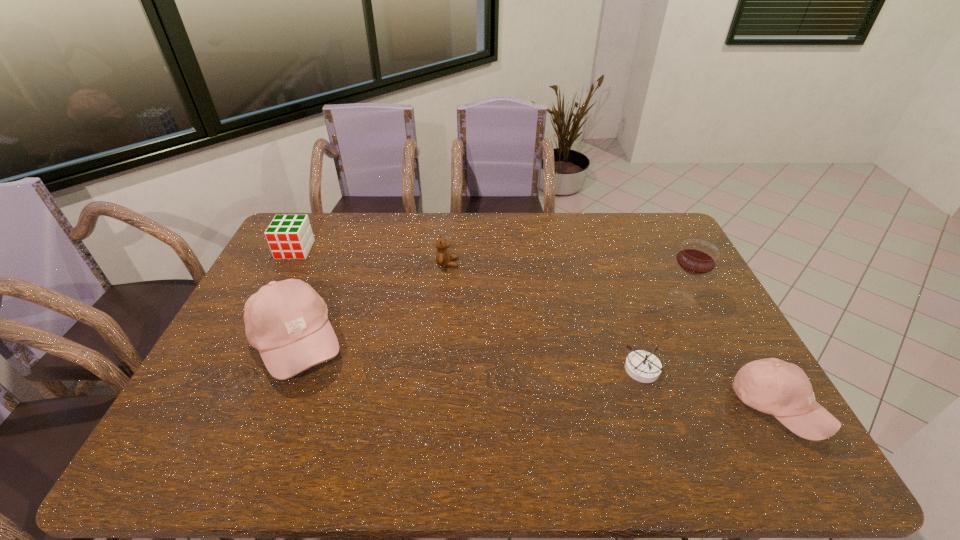
Please point a space for a new baseball_cap to maintain equal intervals. Please provide its 2D coordinates. Your answer should be formatted as a tuple, i.e. [(x, y)], where the tuple contains the x and y coordinates of a point satisfying the conditions above.

[(521, 373)]